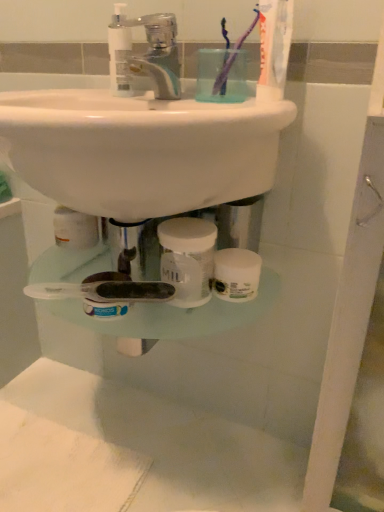
Question: Considering the positions of transparent plastic mouthwash at upper center, the 2th mouthwash from the right, and purple translucent toothbrush at upper center, the 1th toothbrush when ordered from right to left, in the image, is transparent plastic mouthwash at upper center, the 2th mouthwash from the right, wider or thinner than purple translucent toothbrush at upper center, the 1th toothbrush when ordered from right to left,?

Choices:
 (A) thin
 (B) wide

Answer: (A)

Question: From their relative heights in the image, would you say transparent plastic mouthwash at upper center, which is the 1th mouthwash in left-to-right order, is taller or shorter than purple translucent toothbrush at upper center, the 1th toothbrush when ordered from right to left?

Choices:
 (A) tall
 (B) short

Answer: (B)

Question: Which is farther from the white opaque jar at center, the 1th mouthwash in the bottom-to-top sequence?

Choices:
 (A) purple plastic toothbrush at upper center, placed as the 1th toothbrush when sorted from left to right
 (B) clear plastic faucet at upper center
 (C) purple translucent toothbrush at upper center, the 2th toothbrush when ordered from left to right
 (D) transparent plastic mouthwash at upper center, the 1th mouthwash viewed from the top

Answer: (D)

Question: Based on their relative distances, which object is farther from the purple translucent toothbrush at upper center, the 2th toothbrush when ordered from left to right?

Choices:
 (A) purple plastic toothbrush at upper center, placed as the 1th toothbrush when sorted from left to right
 (B) clear plastic faucet at upper center
 (C) transparent plastic mouthwash at upper center, the 1th mouthwash viewed from the top
 (D) white opaque jar at center, which is the second mouthwash in left-to-right order

Answer: (D)